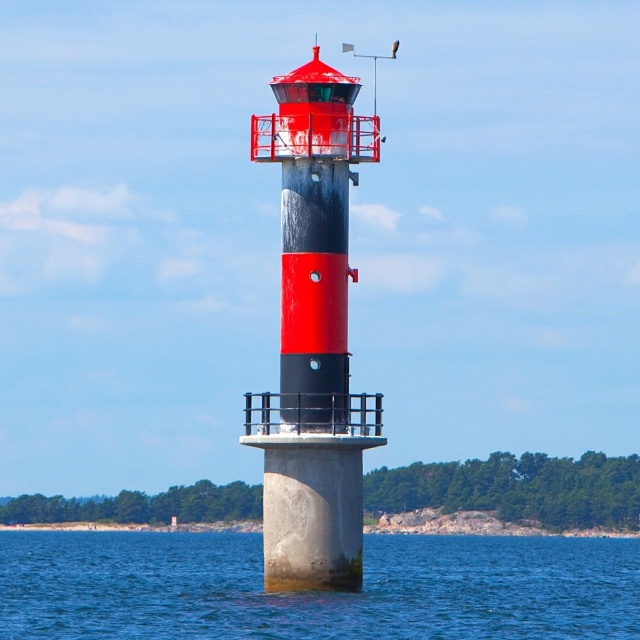
You are a maintenance worker who needs to reach the smooth concrete lighthouse at center from a boat anchored at the blue concrete water at center. Can you safely walk from the boat to the lighthouse without getting wet?

The blue concrete water at center is 16.22 meters from the smooth concrete lighthouse at center. Since the distance is significant, walking from the boat to the lighthouse would require a bridge or a path, which is not mentioned in the scene. Therefore, it is not safe to walk directly without getting wet.

You are standing on a boat looking at the scene. Which object, the blue concrete water at center or the smooth concrete lighthouse at center, is closer to you?

The blue concrete water at center is closer to the viewer than the smooth concrete lighthouse at center according to the description.

You are standing on the deck of a boat in the blue concrete water at center and want to reach the smooth concrete lighthouse at center. Which direction should you move to get closer to the lighthouse?

The blue concrete water at center is positioned under the smooth concrete lighthouse at center, so you should move upward to reach the lighthouse.